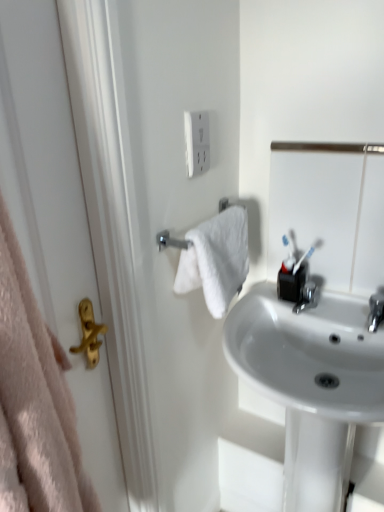
Describe the element at coordinates (44, 165) in the screenshot. This screenshot has height=512, width=384. I see `matte gold handle at left` at that location.

In order to face white plastic outlet at upper center, should I rotate leftwards or rightwards?

You should look right and rotate roughly 1.098 degrees.

What is the approximate width of metallic silver mirror at upper right?

The width of metallic silver mirror at upper right is 2.47 inches.

Measure the distance between white glossy sink at center and camera.

white glossy sink at center is 94.90 centimeters from camera.

Where is `matte gold handle at left`? The height and width of the screenshot is (512, 384). matte gold handle at left is located at coordinates (44, 165).

Can you confirm if matte gold handle at left is positioned to the left of metallic silver mirror at upper right?

Indeed, matte gold handle at left is positioned on the left side of metallic silver mirror at upper right.

Would you say matte gold handle at left contains metallic silver mirror at upper right?

No, metallic silver mirror at upper right is not a part of matte gold handle at left.

Measure the distance from matte gold handle at left to metallic silver mirror at upper right.

matte gold handle at left and metallic silver mirror at upper right are 26.61 inches apart.

Which is less distant, (79, 294) or (361, 151)?

Point (79, 294)

Which is less distant, (272, 387) or (179, 243)?

The point (272, 387) is more forward.

Consider the image. Can you confirm if white glossy sink at center is wider than silver metallic towel rack at center-left?

Yes, white glossy sink at center is wider than silver metallic towel rack at center-left.

From the image's perspective, is white glossy sink at center on top of silver metallic towel rack at center-left?

Incorrect, from the image's perspective, white glossy sink at center is lower than silver metallic towel rack at center-left.

From the picture: Between silver metallic towel rack at center-left and white glossy sink at center, which one appears on the right side from the viewer's perspective?

From the viewer's perspective, white glossy sink at center appears more on the right side.

At what (x,y) coordinates should I click in order to perform the action: click on sink on the right of silver metallic towel rack at center-left. Please return your answer as a coordinate pair (x, y). The height and width of the screenshot is (512, 384). Looking at the image, I should click on [x=311, y=384].

Could you tell me if silver metallic towel rack at center-left is facing white glossy sink at center?

No, silver metallic towel rack at center-left does not turn towards white glossy sink at center.

Is silver metallic towel rack at center-left behind white glossy sink at center?

Yes, silver metallic towel rack at center-left is further from the viewer.

Considering the relative sizes of silver metallic towel rack at center-left and matte gold handle at left in the image provided, is silver metallic towel rack at center-left shorter than matte gold handle at left?

Indeed, silver metallic towel rack at center-left has a lesser height compared to matte gold handle at left.

Could you tell me if silver metallic towel rack at center-left is facing matte gold handle at left?

No, silver metallic towel rack at center-left is not facing towards matte gold handle at left.

What's the angular difference between silver metallic towel rack at center-left and matte gold handle at left's facing directions?

0.828 degrees.

How distant is silver metallic towel rack at center-left from matte gold handle at left?

They are 12.64 inches apart.

Based on the photo, from the image's perspective, is white plastic outlet at upper center above or below matte gold handle at left?

Clearly, from the image's perspective, white plastic outlet at upper center is above matte gold handle at left.

Are white plastic outlet at upper center and matte gold handle at left far apart?

Actually, white plastic outlet at upper center and matte gold handle at left are a little close together.

Which object is further away from the camera taking this photo, white plastic outlet at upper center or matte gold handle at left?

white plastic outlet at upper center.

Does white plastic outlet at upper center appear on the left side of matte gold handle at left?

No, white plastic outlet at upper center is not to the left of matte gold handle at left.

Is metallic silver mirror at upper right situated inside white glossy sink at center or outside?

metallic silver mirror at upper right cannot be found inside white glossy sink at center.

Who is bigger, metallic silver mirror at upper right or white glossy sink at center?

white glossy sink at center is bigger.

Is metallic silver mirror at upper right with white glossy sink at center?

metallic silver mirror at upper right is not next to white glossy sink at center, and they're not touching.

Between silver metallic towel rack at center-left and white plastic outlet at upper center, which one is positioned in front?

silver metallic towel rack at center-left is in front.

How different are the orientations of silver metallic towel rack at center-left and white plastic outlet at upper center in degrees?

silver metallic towel rack at center-left and white plastic outlet at upper center are facing 0.0011 degrees away from each other.

From their relative heights in the image, would you say silver metallic towel rack at center-left is taller or shorter than white plastic outlet at upper center?

In the image, silver metallic towel rack at center-left appears to be shorter than white plastic outlet at upper center.

Can you confirm if silver metallic towel rack at center-left is wider than white plastic outlet at upper center?

Indeed, silver metallic towel rack at center-left has a greater width compared to white plastic outlet at upper center.

Where is `screen door below the metallic silver mirror at upper right (from a real-world perspective)`? This screenshot has width=384, height=512. screen door below the metallic silver mirror at upper right (from a real-world perspective) is located at coordinates (44, 165).

At what (x,y) coordinates should I click in order to perform the action: click on sink that appears in front of the silver metallic towel rack at center-left. Please return your answer as a coordinate pair (x, y). This screenshot has width=384, height=512. Looking at the image, I should click on (311, 384).

Based on their spatial positions, is metallic silver mirror at upper right or white glossy sink at center further from white plastic outlet at upper center?

white glossy sink at center is positioned further to the anchor white plastic outlet at upper center.

Considering their positions, is white plastic outlet at upper center positioned closer to silver metallic towel rack at center-left than metallic silver mirror at upper right?

white plastic outlet at upper center is closer to silver metallic towel rack at center-left.

Which object lies further to the anchor point white plastic outlet at upper center, white glossy sink at center or matte gold handle at left?

Based on the image, white glossy sink at center appears to be further to white plastic outlet at upper center.

When comparing their distances from silver metallic towel rack at center-left, does metallic silver mirror at upper right or matte gold handle at left seem closer?

metallic silver mirror at upper right is closer to silver metallic towel rack at center-left.

Which object lies further to the anchor point matte gold handle at left, silver metallic towel rack at center-left or white plastic outlet at upper center?

The object further to matte gold handle at left is white plastic outlet at upper center.

Which object lies nearer to the anchor point white plastic outlet at upper center, metallic silver mirror at upper right or matte gold handle at left?

metallic silver mirror at upper right.

Looking at the image, which one is located further to white glossy sink at center, silver metallic towel rack at center-left or metallic silver mirror at upper right?

Based on the image, silver metallic towel rack at center-left appears to be further to white glossy sink at center.

Based on their spatial positions, is white plastic outlet at upper center or matte gold handle at left closer to white glossy sink at center?

matte gold handle at left is closer to white glossy sink at center.

The height and width of the screenshot is (512, 384). I want to click on mirror between white plastic outlet at upper center and white glossy sink at center from top to bottom, so click(330, 211).

Identify the location of towel rack that lies between metallic silver mirror at upper right and white glossy sink at center from top to bottom. (171, 241).

The image size is (384, 512). I want to click on screen door between white plastic outlet at upper center and white glossy sink at center vertically, so click(x=44, y=165).

This screenshot has width=384, height=512. I want to click on electric outlet between matte gold handle at left and metallic silver mirror at upper right in the front-back direction, so (x=197, y=142).